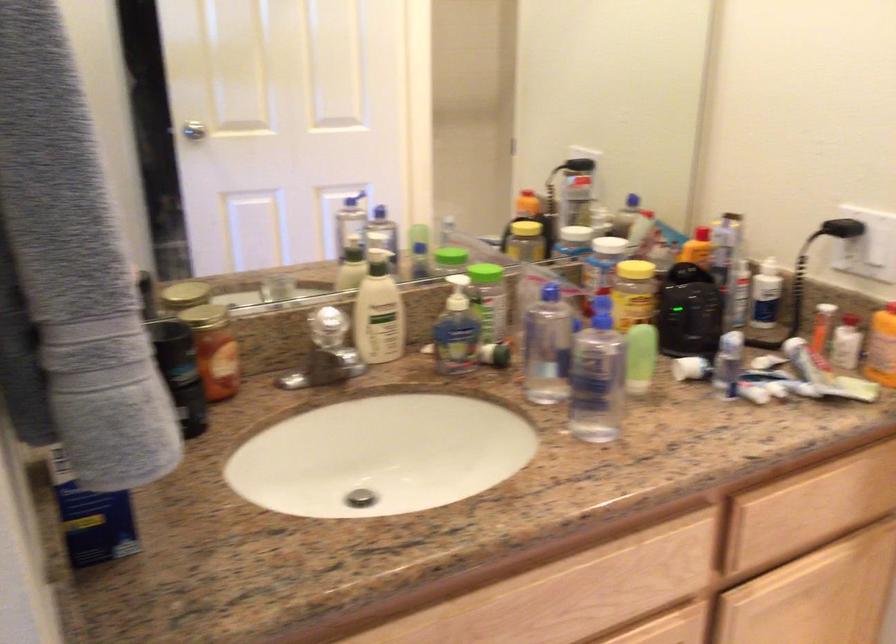
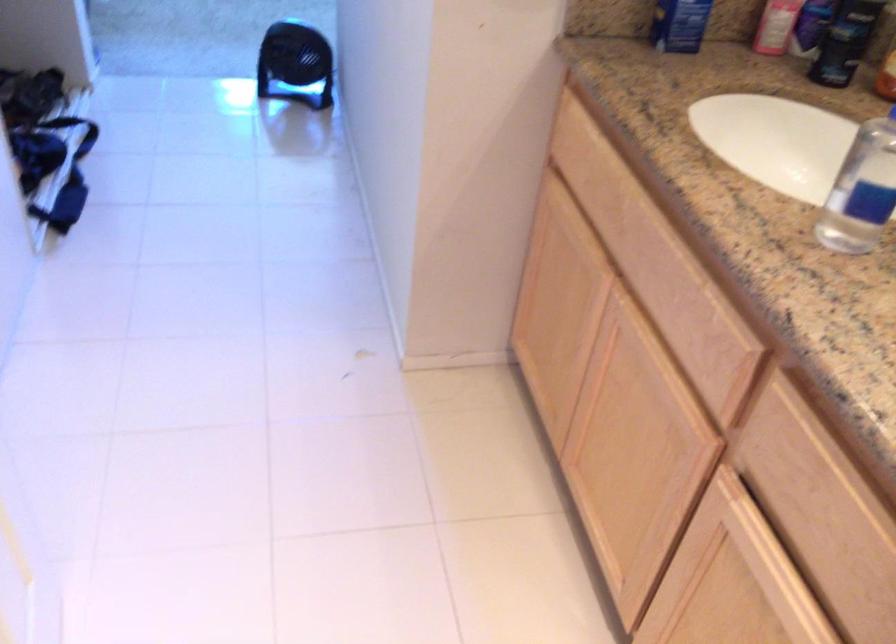
Find the pixel in the second image that matches (x=209, y=373) in the first image.

(845, 41)